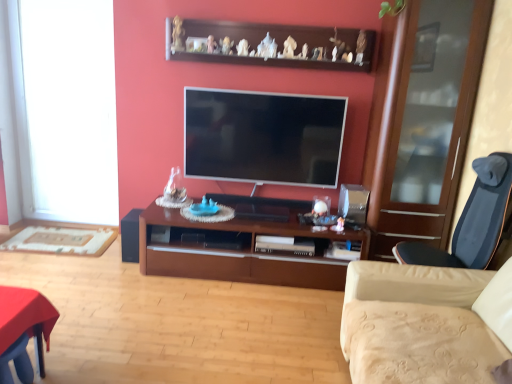
At what (x,y) coordinates should I click in order to perform the action: click on beige fabric studio couch at lower right. Please return your answer as a coordinate pair (x, y). The width and height of the screenshot is (512, 384). Looking at the image, I should click on (425, 323).

Find the location of `wooden shelf at upper center`. wooden shelf at upper center is located at coordinates (270, 45).

This screenshot has height=384, width=512. In order to click on beige fabric studio couch at lower right in this screenshot , I will do `click(425, 323)`.

Who is taller, flat screen tv at center or dark blue fabric chair at right?

flat screen tv at center.

Which point is more forward, (246, 113) or (506, 181)?

Point (506, 181)

Locate an element on the screen. chair below the flat screen tv at center (from the image's perspective) is located at coordinates (471, 221).

Considering the sizes of flat screen tv at center and dark blue fabric chair at right in the image, is flat screen tv at center wider or thinner than dark blue fabric chair at right?

In the image, flat screen tv at center appears to be more narrow than dark blue fabric chair at right.

Based on their positions, is flat screen tv at center located to the left or right of brown wood cabinet at center?

In the image, flat screen tv at center appears on the right side of brown wood cabinet at center.

From a real-world perspective, is flat screen tv at center on brown wood cabinet at center?

Yes, from a real-world perspective, flat screen tv at center is over brown wood cabinet at center

Consider the image. How different are the orientations of flat screen tv at center and brown wood cabinet at center in degrees?

0.00011 degrees.

From the image's perspective, is dark blue fabric chair at right above or below white glass window at left?

Clearly, from the image's perspective, dark blue fabric chair at right is below white glass window at left.

Is dark blue fabric chair at right placed right next to white glass window at left?

No, dark blue fabric chair at right is not making contact with white glass window at left.

Looking at this image, which object is closer to the camera taking this photo, dark blue fabric chair at right or white glass window at left?

dark blue fabric chair at right is closer to the camera.

From a real-world perspective, between dark blue fabric chair at right and flat screen tv at center, who is vertically lower?

dark blue fabric chair at right, from a real-world perspective.

Locate an element on the screen. This screenshot has width=512, height=384. chair that is below the flat screen tv at center (from the image's perspective) is located at coordinates (471, 221).

Can you see dark blue fabric chair at right touching flat screen tv at center?

No, dark blue fabric chair at right is not beside flat screen tv at center.

Is dark blue fabric chair at right shorter than flat screen tv at center?

Correct, dark blue fabric chair at right is not as tall as flat screen tv at center.

Is point (197, 27) in front of point (32, 80)?

Yes.

Is wooden shelf at upper center beside white glass window at left?

wooden shelf at upper center and white glass window at left are not in contact.

Considering their positions, is wooden shelf at upper center located in front of or behind white glass window at left?

Clearly, wooden shelf at upper center is in front of white glass window at left.

Find the location of a particular element. The image size is (512, 384). shelf above the white glass window at left (from the image's perspective) is located at coordinates (270, 45).

In the image, is wooden shelf at upper center on the left side or the right side of beige fabric studio couch at lower right?

In the image, wooden shelf at upper center appears on the left side of beige fabric studio couch at lower right.

This screenshot has width=512, height=384. I want to click on shelf above the beige fabric studio couch at lower right (from a real-world perspective), so click(270, 45).

Looking at this image, in the image, is wooden shelf at upper center positioned in front of or behind beige fabric studio couch at lower right?

Visually, wooden shelf at upper center is located behind beige fabric studio couch at lower right.

Is wooden shelf at upper center taller or shorter than beige fabric studio couch at lower right?

Clearly, wooden shelf at upper center is shorter compared to beige fabric studio couch at lower right.

Is transparent glass cabinet at right inside the boundaries of beige fabric studio couch at lower right, or outside?

transparent glass cabinet at right exists outside the volume of beige fabric studio couch at lower right.

Between transparent glass cabinet at right and beige fabric studio couch at lower right, which one is positioned in front?

beige fabric studio couch at lower right is more forward.

Does transparent glass cabinet at right turn towards beige fabric studio couch at lower right?

Yes, transparent glass cabinet at right is turned towards beige fabric studio couch at lower right.

Is transparent glass cabinet at right not close to beige fabric studio couch at lower right?

transparent glass cabinet at right is far away from beige fabric studio couch at lower right.

This screenshot has width=512, height=384. What are the coordinates of `chair in front of the flat screen tv at center` in the screenshot? It's located at (471, 221).

Image resolution: width=512 pixels, height=384 pixels. I want to click on television that appears on the right of brown wood cabinet at center, so point(263,137).

From the image, which object appears to be farther from dark blue fabric chair at right, black matte speaker at lower left or wooden shelf at upper center?

The object further to dark blue fabric chair at right is black matte speaker at lower left.

Based on the photo, which object lies further to the anchor point black matte speaker at lower left, flat screen tv at center or wooden shelf at upper center?

wooden shelf at upper center lies further to black matte speaker at lower left than the other object.

In the scene shown: From the image, which object appears to be farther from brown wood cabinet at center, black matte speaker at lower left or dark blue fabric chair at right?

dark blue fabric chair at right is positioned further to the anchor brown wood cabinet at center.

Considering their positions, is white glass window at left positioned closer to wooden shelf at upper center than black matte speaker at lower left?

white glass window at left lies closer to wooden shelf at upper center than the other object.

Based on their spatial positions, is wooden shelf at upper center or flat screen tv at center closer to transparent glass cabinet at right?

The object closer to transparent glass cabinet at right is flat screen tv at center.

Considering their positions, is black matte speaker at lower left positioned further to white glass window at left than dark blue fabric chair at right?

dark blue fabric chair at right lies further to white glass window at left than the other object.

Considering their positions, is wooden shelf at upper center positioned further to white glass window at left than transparent glass cabinet at right?

transparent glass cabinet at right is further to white glass window at left.

From the image, which object appears to be nearer to white glass window at left, brown wood cabinet at center or dark blue fabric chair at right?

Among the two, brown wood cabinet at center is located nearer to white glass window at left.

The height and width of the screenshot is (384, 512). I want to click on shelf between flat screen tv at center and dark blue fabric chair at right from left to right, so click(270, 45).

The width and height of the screenshot is (512, 384). Identify the location of glass door between beige fabric studio couch at lower right and wooden shelf at upper center from front to back. (423, 121).

The height and width of the screenshot is (384, 512). What are the coordinates of `shelf located between white glass window at left and beige fabric studio couch at lower right in the left-right direction` in the screenshot? It's located at (270, 45).

You are a GUI agent. You are given a task and a screenshot of the screen. Output one action in this format:
    pyautogui.click(x=<x>, y=<y>)
    Task: Click on the shelf between white glass window at left and transparent glass cabinet at right in the horizontal direction
    This screenshot has width=512, height=384.
    Given the screenshot: What is the action you would take?
    pyautogui.click(x=270, y=45)